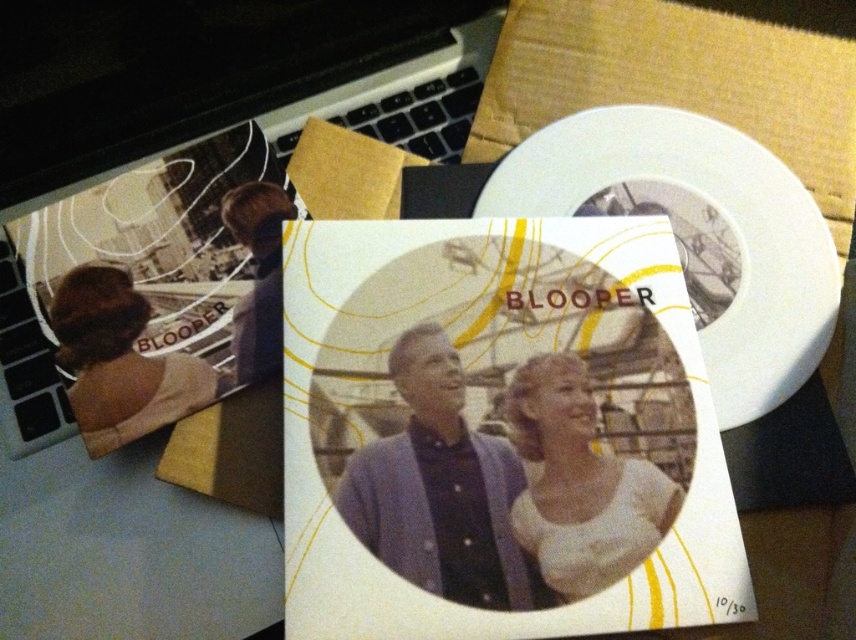
You are organizing items on a desk and need to place the silver metallic laptop at upper center and the purple fabric at center. If you want to stack them vertically, which one should go on the bottom to ensure stability?

The silver metallic laptop at upper center is taller than the purple fabric at center, so it should be placed on the bottom to provide a stable base for stacking.

You are organizing a desk and need to place both the matte white postcard at center and the silver metallic laptop at upper center. Which item requires more desk space?

The silver metallic laptop at upper center requires more desk space because the matte white postcard at center occupies less space than it.

You are looking at the image of the desk setup. There are two points marked on the image at coordinates point [432,392] and point [589,534]. Which point is closer to you?

Point [432,392] is further to the viewer than point [589,534], so point [432,392] is closer to you.